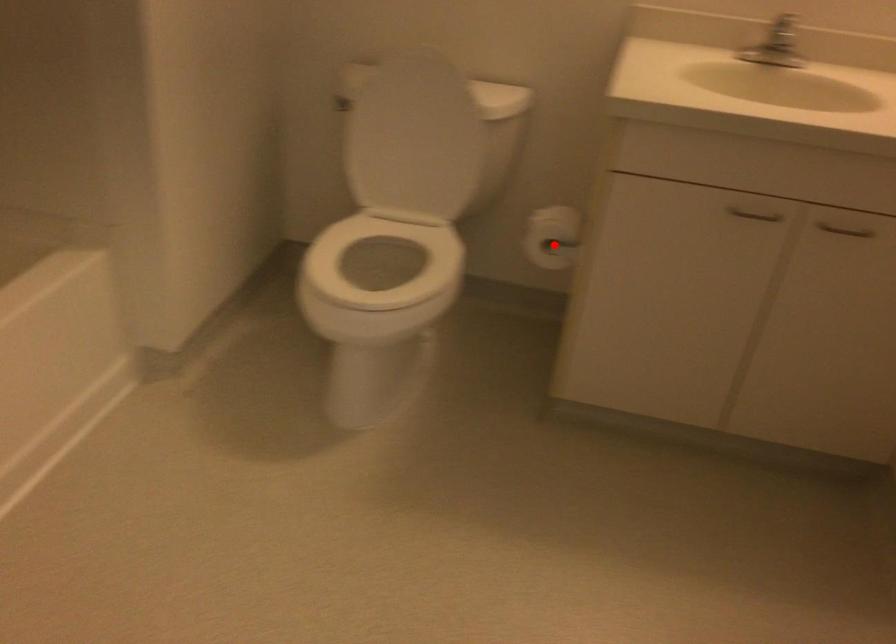
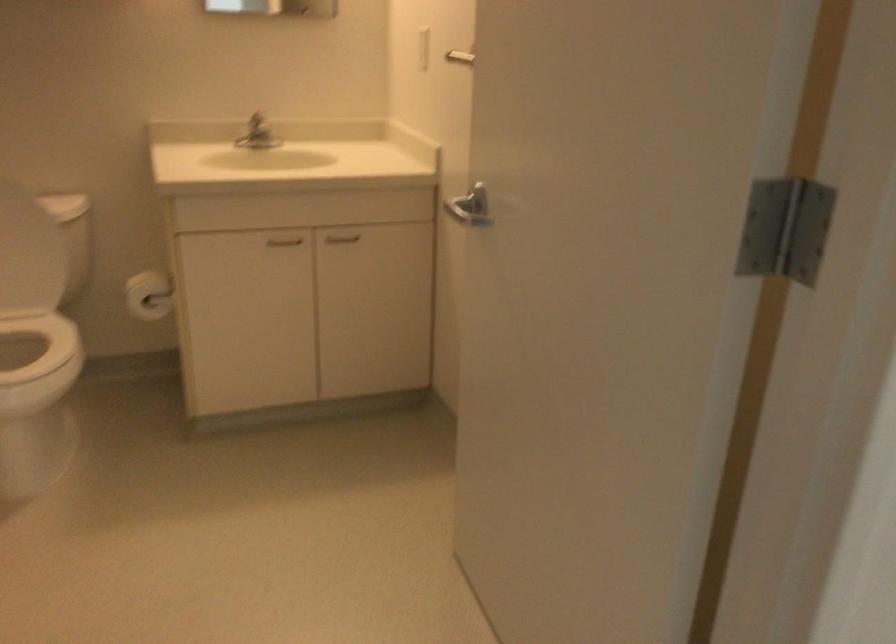
Question: I am providing you with two images of the same scene from different viewpoints. A red point is shown in image1. For the corresponding object point in image2, is it positioned nearer or farther from the camera?

Choices:
 (A) Nearer
 (B) Farther

Answer: (B)